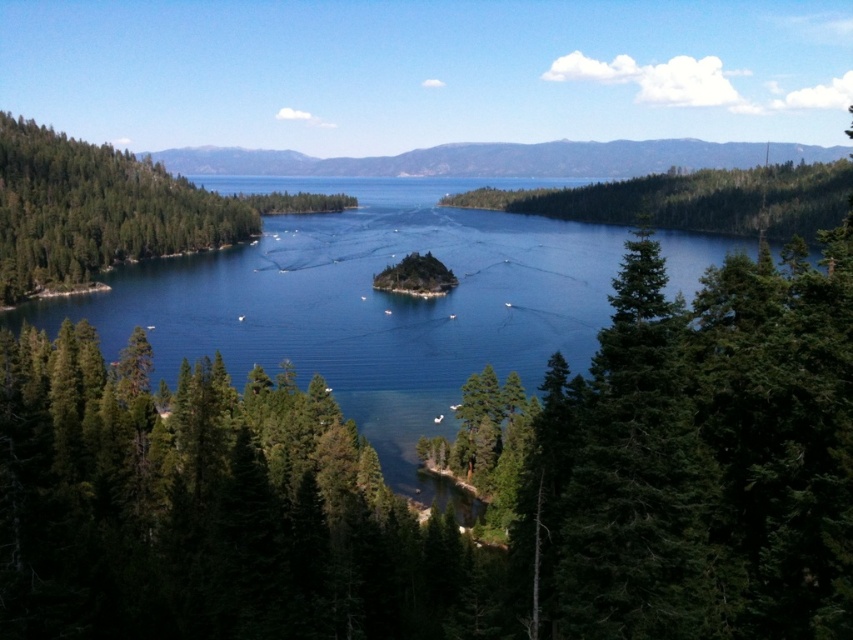
Can you confirm if blue water at center is positioned above green matte tree at left?

No, blue water at center is not above green matte tree at left.

Which of these two, blue water at center or green matte tree at left, stands shorter?

green matte tree at left

Does point (523, 262) lie behind point (90, 148)?

No, (523, 262) is closer to viewer.

Identify the location of blue water at center. (369, 301).